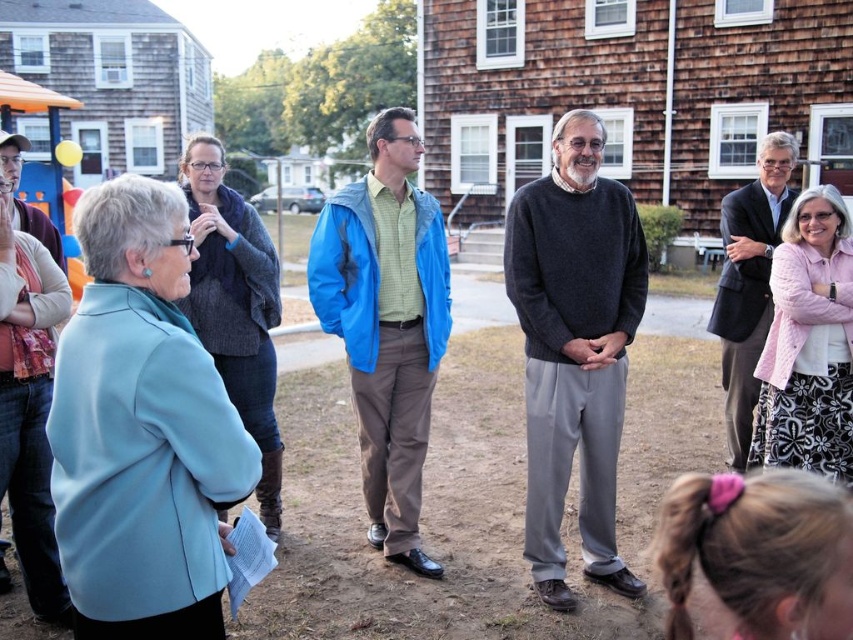
You are organizing a charity event and need to determine if the dark gray sweater at center and the dark gray suit at right can fit into a storage box that can only hold items smaller than the size of the sweater. Which item should you place in the box?

The dark gray suit at right is smaller than the dark gray sweater at center, so you should place the dark gray suit at right in the storage box since it is smaller and fits the size requirement.

You are standing in the residential area scene and want to determine which of the two points, point (x=532, y=524) or point (x=747, y=413), is nearer to you. Based on the scene description, can you identify which point is closer?

Point (x=532, y=524) is closer to the viewer than point (x=747, y=413).

Based on the photo, where is the dark gray sweater at center located in the image?

The dark gray sweater at center is located at point 0.545 on the horizontal axis and 0.674 on the vertical axis.